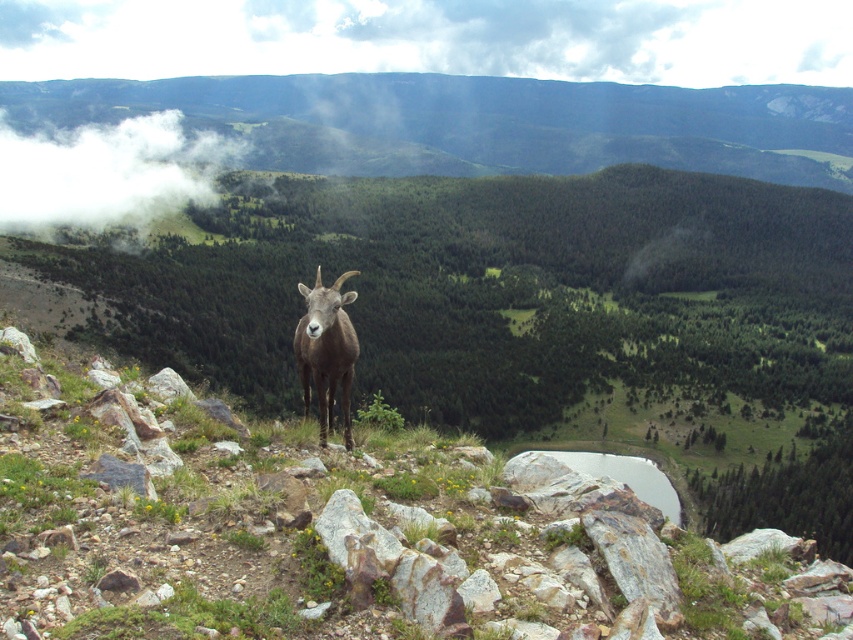
Between white fluffy cloud at upper left and brown woolly goat at center, which one has less height?

brown woolly goat at center is shorter.

The height and width of the screenshot is (640, 853). Describe the element at coordinates (106, 173) in the screenshot. I see `white fluffy cloud at upper left` at that location.

At what (x,y) coordinates should I click in order to perform the action: click on white fluffy cloud at upper left. Please return your answer as a coordinate pair (x, y). This screenshot has width=853, height=640. Looking at the image, I should click on (106, 173).